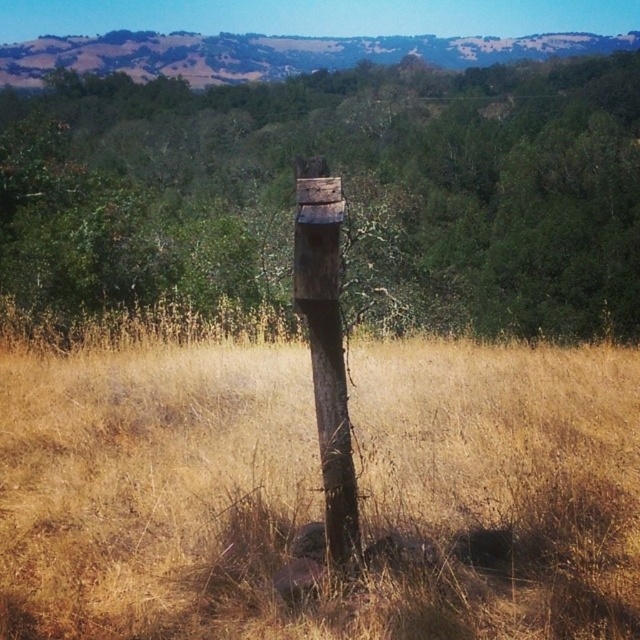
Question: Can you confirm if dry grass at center is positioned below weathered wood post at center?

Choices:
 (A) yes
 (B) no

Answer: (A)

Question: Is dry grass at center wider than weathered wood post at center?

Choices:
 (A) yes
 (B) no

Answer: (A)

Question: Does dry grass at center have a smaller size compared to weathered wood post at center?

Choices:
 (A) yes
 (B) no

Answer: (B)